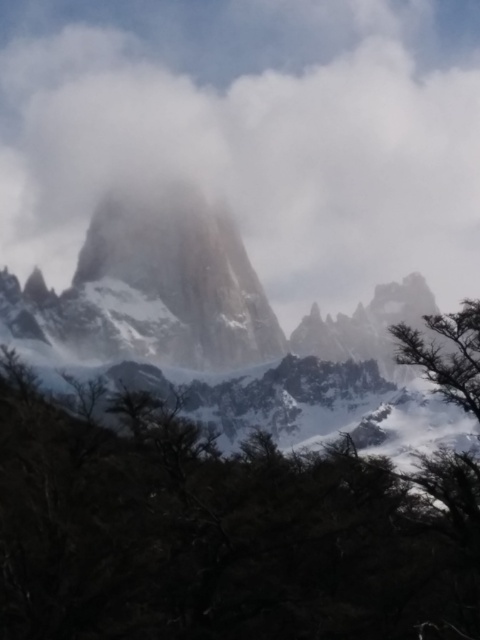
Question: Which point appears closest to the camera in this image?

Choices:
 (A) (38, 72)
 (B) (189, 220)
 (C) (278, 573)

Answer: (C)

Question: Which point is closer to the camera?

Choices:
 (A) white fluffy cloud at upper center
 (B) dark green leafy tree at center
 (C) sandy beige rock at center

Answer: (B)

Question: Is dark green leafy tree at center smaller than sandy beige rock at center?

Choices:
 (A) no
 (B) yes

Answer: (A)

Question: Does white fluffy cloud at upper center come behind sandy beige rock at center?

Choices:
 (A) no
 (B) yes

Answer: (B)

Question: Does white fluffy cloud at upper center have a larger size compared to sandy beige rock at center?

Choices:
 (A) yes
 (B) no

Answer: (A)

Question: Which is farther from the dark green leafy tree at center?

Choices:
 (A) white fluffy cloud at upper center
 (B) sandy beige rock at center

Answer: (A)